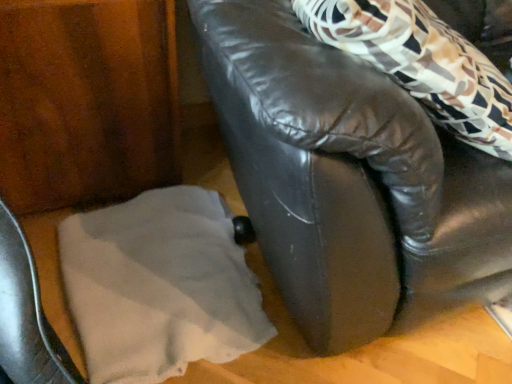
What do you see at coordinates (349, 181) in the screenshot? I see `black leather couch at center` at bounding box center [349, 181].

The image size is (512, 384). What are the coordinates of `black leather couch at center` in the screenshot? It's located at (349, 181).

Measure the distance between white fabric at lower left and camera.

Answer: white fabric at lower left and camera are 32.33 inches apart.

Locate an element on the screen. white fabric at lower left is located at coordinates (159, 286).

What do you see at coordinates (159, 286) in the screenshot? I see `white fabric at lower left` at bounding box center [159, 286].

What are the coordinates of `black leather couch at center` in the screenshot? It's located at (349, 181).

Considering the relative positions of black leather couch at center and white fabric at lower left in the image provided, is black leather couch at center to the right of white fabric at lower left from the viewer's perspective?

Yes, black leather couch at center is to the right of white fabric at lower left.

Which object is further away from the camera taking this photo, black leather couch at center or white fabric at lower left?

white fabric at lower left is further from the camera.

Is point (353, 287) positioned behind point (181, 205)?

No, (353, 287) is closer to viewer.

From the image's perspective, does black leather couch at center appear lower than white fabric at lower left?

Actually, black leather couch at center appears above white fabric at lower left in the image.

From a real-world perspective, is black leather couch at center under white fabric at lower left?

Incorrect, from a real-world perspective, black leather couch at center is higher than white fabric at lower left.

Between black leather couch at center and white fabric at lower left, which one has larger width?

With larger width is black leather couch at center.

In terms of height, does black leather couch at center look taller or shorter compared to white fabric at lower left?

In the image, black leather couch at center appears to be taller than white fabric at lower left.

In terms of size, does black leather couch at center appear bigger or smaller than white fabric at lower left?

Considering their sizes, black leather couch at center takes up more space than white fabric at lower left.

Is white fabric at lower left a part of black leather couch at center?

No, white fabric at lower left is not surrounded by black leather couch at center.

Would you consider black leather couch at center to be distant from white fabric at lower left?

No.

Is black leather couch at center turned away from white fabric at lower left?

No, black leather couch at center's orientation is not away from white fabric at lower left.

The image size is (512, 384). I want to click on linen behind the black leather couch at center, so click(159, 286).

Looking at this image, can you confirm if white fabric at lower left is positioned to the left of black leather couch at center?

Indeed, white fabric at lower left is positioned on the left side of black leather couch at center.

Considering their positions, is white fabric at lower left located in front of or behind black leather couch at center?

In the image, white fabric at lower left appears behind black leather couch at center.

Considering the points (151, 219) and (468, 191), which point is in front, point (151, 219) or point (468, 191)?

The point (468, 191) is closer to the camera.

From the image's perspective, which one is positioned lower, white fabric at lower left or black leather couch at center?

white fabric at lower left appears lower in the image.

From a real-world perspective, which is physically below, white fabric at lower left or black leather couch at center?

white fabric at lower left, from a real-world perspective.

Can you confirm if white fabric at lower left is thinner than black leather couch at center?

Yes.

Consider the image. Considering the sizes of objects white fabric at lower left and black leather couch at center in the image provided, who is shorter, white fabric at lower left or black leather couch at center?

With less height is white fabric at lower left.

Between white fabric at lower left and black leather couch at center, which one has smaller size?

white fabric at lower left.

Is white fabric at lower left surrounding black leather couch at center?

Definitely not — black leather couch at center is not inside white fabric at lower left.

Are white fabric at lower left and black leather couch at center beside each other?

No, white fabric at lower left is not in contact with black leather couch at center.

Could you tell me if white fabric at lower left is turned towards black leather couch at center?

No, white fabric at lower left does not turn towards black leather couch at center.

You are a GUI agent. You are given a task and a screenshot of the screen. Output one action in this format:
    pyautogui.click(x=<x>, y=<y>)
    Task: Click on the furniture in front of the white fabric at lower left
    This screenshot has width=512, height=384.
    Given the screenshot: What is the action you would take?
    pyautogui.click(x=349, y=181)

The image size is (512, 384). In order to click on linen behind the black leather couch at center in this screenshot , I will do `click(159, 286)`.

In the image, there is a black leather couch at center. What are the coordinates of `linen below it (from a real-world perspective)` in the screenshot? It's located at (159, 286).